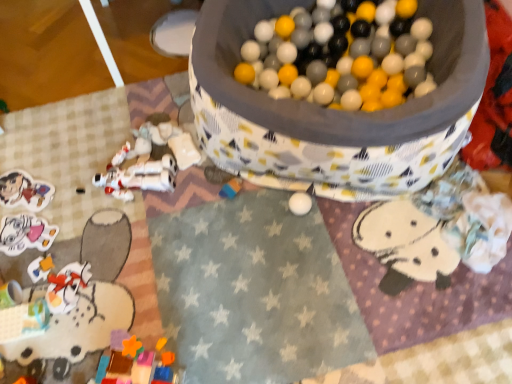
Locate an element on the screen. Image resolution: width=512 pixels, height=384 pixels. free spot to the left of fluffy white blanket at lower right, arranged as the 1th toy when viewed from the right is located at coordinates (382, 245).